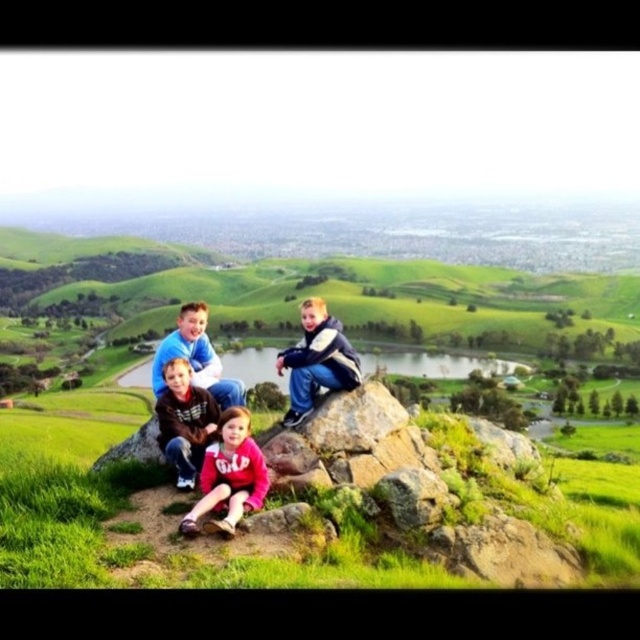
Who is lower down, matte pink hoodie at lower center or blue fleece jacket at center?

matte pink hoodie at lower center is lower down.

Who is more distant from viewer, [252,456] or [205,340]?

The point [205,340] is behind.

Find the location of a particular element. The image size is (640, 640). matte pink hoodie at lower center is located at coordinates (228, 476).

Is matte pink hoodie at lower center to the left of smooth gray rock at center from the viewer's perspective?

Correct, you'll find matte pink hoodie at lower center to the left of smooth gray rock at center.

Which is in front, point (260, 452) or point (378, 403)?

Point (260, 452) is more forward.

What are the coordinates of `matte pink hoodie at lower center` in the screenshot? It's located at (228, 476).

Which is more to the left, green grassy lake at center or blue denim jeans at center?

From the viewer's perspective, green grassy lake at center appears more on the left side.

Is the position of green grassy lake at center more distant than that of blue denim jeans at center?

Yes.

Does point (225, 365) come in front of point (330, 320)?

No, it is behind (330, 320).

The width and height of the screenshot is (640, 640). Identify the location of green grassy lake at center. (435, 364).